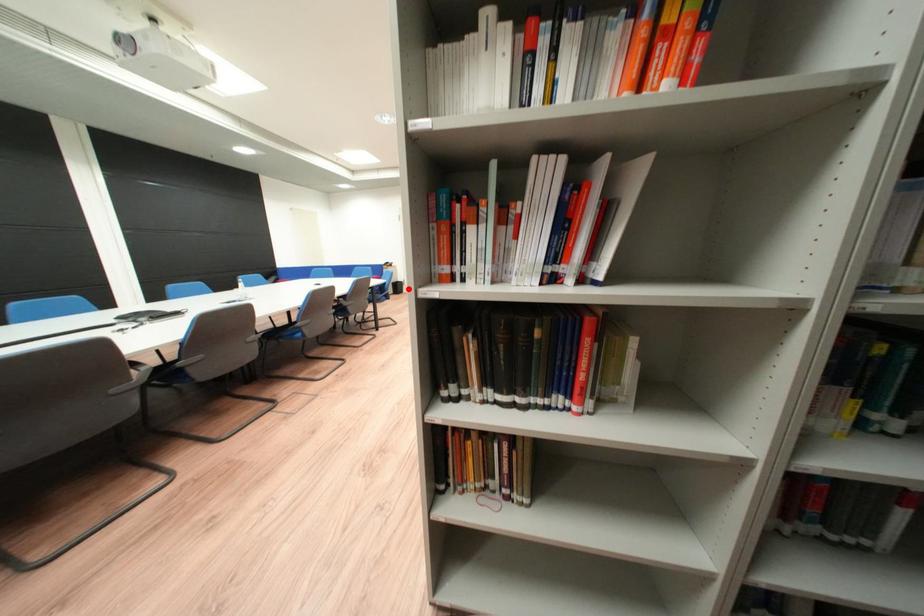
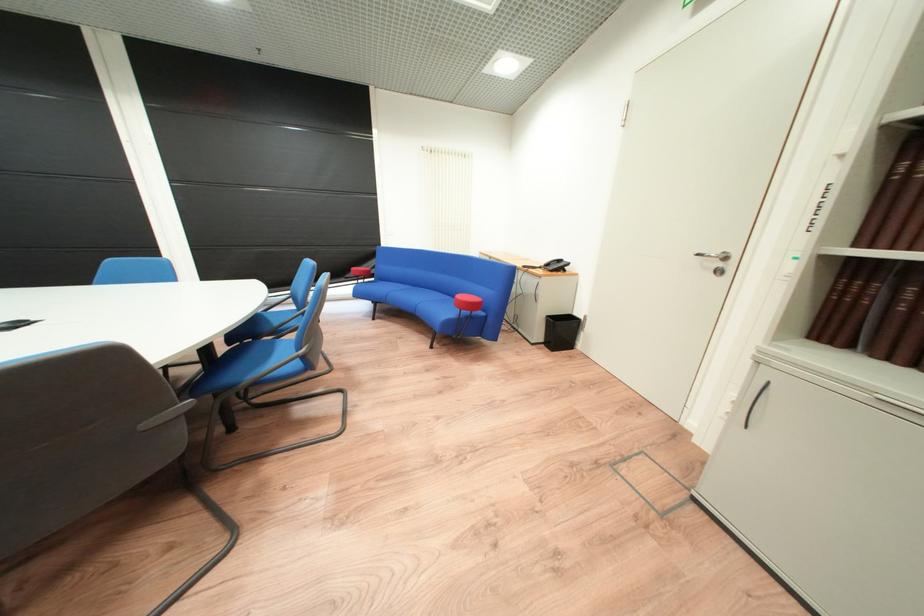
Question: I am providing you with two images of the same scene from different viewpoints. A red point is shown in image1. For the corresponding object point in image2, is it positioned nearer or farther from the camera?

Choices:
 (A) Nearer
 (B) Farther

Answer: (A)